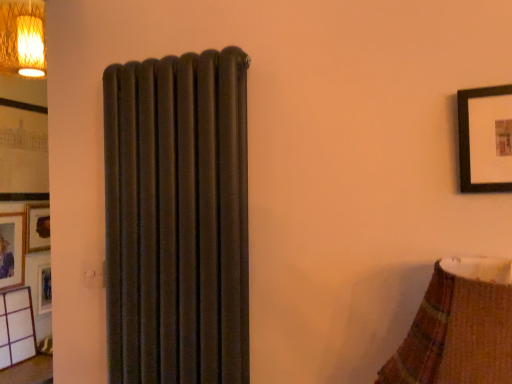
Where is `matte wooden picture frame at left, the 1th picture frame positioned from the bottom`? matte wooden picture frame at left, the 1th picture frame positioned from the bottom is located at coordinates (12, 249).

Describe the element at coordinates (12, 249) in the screenshot. I see `matte wooden picture frame at left, marked as the second picture frame in a top-to-bottom arrangement` at that location.

Where is `matte black picture frame at left, the first picture frame positioned from the top`? matte black picture frame at left, the first picture frame positioned from the top is located at coordinates (23, 152).

This screenshot has width=512, height=384. What do you see at coordinates (23, 152) in the screenshot?
I see `matte black picture frame at left, arranged as the 2th picture frame when ordered from the bottom` at bounding box center [23, 152].

Measure the distance between point [24,161] and camera.

Point [24,161] and camera are 3.04 meters apart from each other.

At what (x,y) coordinates should I click in order to perform the action: click on matte wooden picture frame at left, marked as the second picture frame in a top-to-bottom arrangement. Please return your answer as a coordinate pair (x, y). Looking at the image, I should click on (12, 249).

Does matte wooden picture frame at left, the 1th picture frame positioned from the bottom, appear on the right side of matte black picture frame at left, arranged as the 2th picture frame when ordered from the bottom?

→ No, matte wooden picture frame at left, the 1th picture frame positioned from the bottom, is not to the right of matte black picture frame at left, arranged as the 2th picture frame when ordered from the bottom.

Considering the positions of objects matte wooden picture frame at left, the 1th picture frame positioned from the bottom, and matte black picture frame at left, the first picture frame positioned from the top, in the image provided, who is in front, matte wooden picture frame at left, the 1th picture frame positioned from the bottom, or matte black picture frame at left, the first picture frame positioned from the top,?

Positioned in front is matte wooden picture frame at left, the 1th picture frame positioned from the bottom.

Which is in front, point (16, 256) or point (9, 100)?

Positioned in front is point (9, 100).

From the image's perspective, which one is positioned lower, matte wooden picture frame at left, marked as the second picture frame in a top-to-bottom arrangement, or matte black picture frame at left, arranged as the 2th picture frame when ordered from the bottom?

matte wooden picture frame at left, marked as the second picture frame in a top-to-bottom arrangement.

From a real-world perspective, is matte wooden picture frame at left, marked as the second picture frame in a top-to-bottom arrangement, physically located above or below matte black picture frame at left, the first picture frame positioned from the top?

In terms of real-world spatial position, matte wooden picture frame at left, marked as the second picture frame in a top-to-bottom arrangement, is below matte black picture frame at left, the first picture frame positioned from the top.

Considering the relative sizes of matte wooden picture frame at left, marked as the second picture frame in a top-to-bottom arrangement, and matte black picture frame at left, arranged as the 2th picture frame when ordered from the bottom, in the image provided, is matte wooden picture frame at left, marked as the second picture frame in a top-to-bottom arrangement, wider than matte black picture frame at left, arranged as the 2th picture frame when ordered from the bottom,?

In fact, matte wooden picture frame at left, marked as the second picture frame in a top-to-bottom arrangement, might be narrower than matte black picture frame at left, arranged as the 2th picture frame when ordered from the bottom.

Considering the sizes of objects matte wooden picture frame at left, the 1th picture frame positioned from the bottom, and matte black picture frame at left, arranged as the 2th picture frame when ordered from the bottom, in the image provided, who is taller, matte wooden picture frame at left, the 1th picture frame positioned from the bottom, or matte black picture frame at left, arranged as the 2th picture frame when ordered from the bottom,?

With more height is matte black picture frame at left, arranged as the 2th picture frame when ordered from the bottom.

Consider the image. Considering the sizes of objects matte wooden picture frame at left, the 1th picture frame positioned from the bottom, and matte black picture frame at left, the first picture frame positioned from the top, in the image provided, who is bigger, matte wooden picture frame at left, the 1th picture frame positioned from the bottom, or matte black picture frame at left, the first picture frame positioned from the top,?

matte black picture frame at left, the first picture frame positioned from the top.

Is matte wooden picture frame at left, marked as the second picture frame in a top-to-bottom arrangement, surrounding matte black picture frame at left, arranged as the 2th picture frame when ordered from the bottom?

No, matte black picture frame at left, arranged as the 2th picture frame when ordered from the bottom, is not surrounded by matte wooden picture frame at left, marked as the second picture frame in a top-to-bottom arrangement.

Is matte wooden picture frame at left, the 1th picture frame positioned from the bottom, not close to matte black picture frame at left, arranged as the 2th picture frame when ordered from the bottom?

No, matte wooden picture frame at left, the 1th picture frame positioned from the bottom, is not far away from matte black picture frame at left, arranged as the 2th picture frame when ordered from the bottom.

Does matte wooden picture frame at left, marked as the second picture frame in a top-to-bottom arrangement, turn towards matte black picture frame at left, arranged as the 2th picture frame when ordered from the bottom?

No, matte wooden picture frame at left, marked as the second picture frame in a top-to-bottom arrangement, is not aimed at matte black picture frame at left, arranged as the 2th picture frame when ordered from the bottom.

Identify the location of picture frame located behind the matte wooden picture frame at left, the 1th picture frame positioned from the bottom. The image size is (512, 384). (23, 152).

Which object is positioned more to the left, matte black picture frame at left, arranged as the 2th picture frame when ordered from the bottom, or matte wooden picture frame at left, the 1th picture frame positioned from the bottom?

matte wooden picture frame at left, the 1th picture frame positioned from the bottom, is more to the left.

Which object is closer to the camera taking this photo, matte black picture frame at left, arranged as the 2th picture frame when ordered from the bottom, or matte wooden picture frame at left, the 1th picture frame positioned from the bottom?

matte wooden picture frame at left, the 1th picture frame positioned from the bottom, is closer to the camera.

Is point (29, 156) farther from camera compared to point (10, 273)?

Yes, point (29, 156) is behind point (10, 273).

From the image's perspective, which is below, matte black picture frame at left, arranged as the 2th picture frame when ordered from the bottom, or matte wooden picture frame at left, marked as the second picture frame in a top-to-bottom arrangement?

From the image's view, matte wooden picture frame at left, marked as the second picture frame in a top-to-bottom arrangement, is below.

From a real-world perspective, is matte black picture frame at left, arranged as the 2th picture frame when ordered from the bottom, positioned above or below matte wooden picture frame at left, the 1th picture frame positioned from the bottom?

Clearly, from a real-world perspective, matte black picture frame at left, arranged as the 2th picture frame when ordered from the bottom, is above matte wooden picture frame at left, the 1th picture frame positioned from the bottom.

Considering the relative sizes of matte black picture frame at left, arranged as the 2th picture frame when ordered from the bottom, and matte wooden picture frame at left, the 1th picture frame positioned from the bottom, in the image provided, is matte black picture frame at left, arranged as the 2th picture frame when ordered from the bottom, thinner than matte wooden picture frame at left, the 1th picture frame positioned from the bottom,?

No.

Looking at this image, considering the sizes of matte black picture frame at left, the first picture frame positioned from the top, and matte wooden picture frame at left, marked as the second picture frame in a top-to-bottom arrangement, in the image, is matte black picture frame at left, the first picture frame positioned from the top, taller or shorter than matte wooden picture frame at left, marked as the second picture frame in a top-to-bottom arrangement,?

matte black picture frame at left, the first picture frame positioned from the top, is taller than matte wooden picture frame at left, marked as the second picture frame in a top-to-bottom arrangement.

Considering the sizes of objects matte black picture frame at left, arranged as the 2th picture frame when ordered from the bottom, and matte wooden picture frame at left, the 1th picture frame positioned from the bottom, in the image provided, who is bigger, matte black picture frame at left, arranged as the 2th picture frame when ordered from the bottom, or matte wooden picture frame at left, the 1th picture frame positioned from the bottom,?

matte black picture frame at left, arranged as the 2th picture frame when ordered from the bottom, is bigger.

Choose the correct answer: Is matte black picture frame at left, arranged as the 2th picture frame when ordered from the bottom, inside matte wooden picture frame at left, the 1th picture frame positioned from the bottom, or outside it?

The correct answer is: outside.

Looking at this image, is matte black picture frame at left, the first picture frame positioned from the top, far away from matte wooden picture frame at left, marked as the second picture frame in a top-to-bottom arrangement?

No, matte black picture frame at left, the first picture frame positioned from the top, is not far from matte wooden picture frame at left, marked as the second picture frame in a top-to-bottom arrangement.

Could you tell me if matte black picture frame at left, arranged as the 2th picture frame when ordered from the bottom, is turned towards matte wooden picture frame at left, marked as the second picture frame in a top-to-bottom arrangement?

No.

You are a GUI agent. You are given a task and a screenshot of the screen. Output one action in this format:
    pyautogui.click(x=<x>, y=<y>)
    Task: Click on the picture frame located in front of the matte black picture frame at left, arranged as the 2th picture frame when ordered from the bottom
    This screenshot has width=512, height=384.
    Given the screenshot: What is the action you would take?
    pyautogui.click(x=12, y=249)

You are a GUI agent. You are given a task and a screenshot of the screen. Output one action in this format:
    pyautogui.click(x=<x>, y=<y>)
    Task: Click on the picture frame below the matte black picture frame at left, arranged as the 2th picture frame when ordered from the bottom (from the image's perspective)
    
    Given the screenshot: What is the action you would take?
    pyautogui.click(x=12, y=249)

Where is `picture frame behind the matte wooden picture frame at left, marked as the second picture frame in a top-to-bottom arrangement`? The image size is (512, 384). picture frame behind the matte wooden picture frame at left, marked as the second picture frame in a top-to-bottom arrangement is located at coordinates (23, 152).